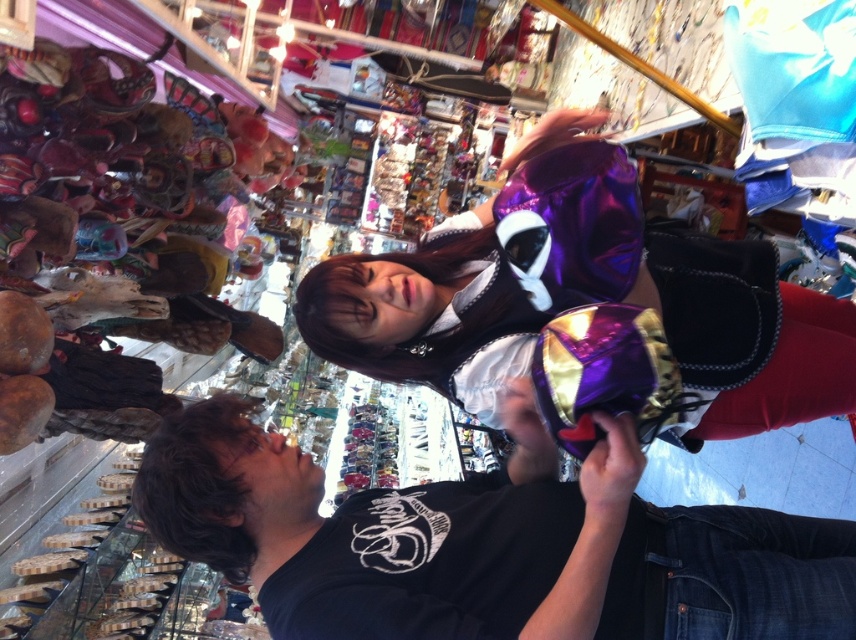
You are standing in the store and want to locate the black matte shirt at lower center. According to the coordinates provided, where should you look to find it?

The black matte shirt at lower center is located at point (486, 544).

You are a photographer trying to capture a clear shot of both the black matte shirt at lower center and the shiny purple dress at center. Since the scene is tilted, you need to adjust your camera angle. Which object should you focus on first to ensure both are in frame?

The black matte shirt at lower center is positioned on the left side of the shiny purple dress at center. To ensure both are in frame, focus on the black matte shirt at lower center first as it is on the left, allowing you to adjust the camera angle to include the shiny purple dress at center on the right.